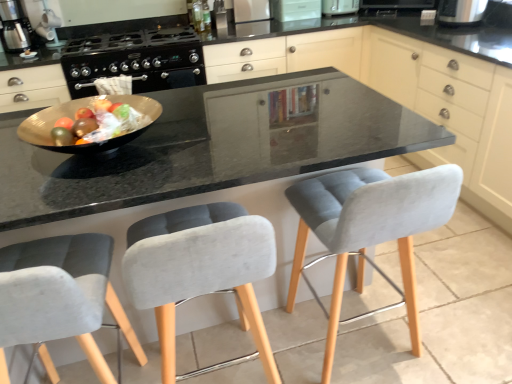
Question: Is metallic silver coffee maker at upper left at the right side of black plastic toaster at upper right, the first appliance when ordered from right to left?

Choices:
 (A) yes
 (B) no

Answer: (B)

Question: From a real-world perspective, is metallic silver coffee maker at upper left below black plastic toaster at upper right, the first appliance when ordered from right to left?

Choices:
 (A) no
 (B) yes

Answer: (A)

Question: Does metallic silver coffee maker at upper left touch black plastic toaster at upper right, the first appliance when ordered from right to left?

Choices:
 (A) no
 (B) yes

Answer: (A)

Question: From the image's perspective, is metallic silver coffee maker at upper left on black plastic toaster at upper right, the fifth appliance positioned from the left?

Choices:
 (A) yes
 (B) no

Answer: (B)

Question: Considering the relative sizes of metallic silver coffee maker at upper left and black plastic toaster at upper right, the fifth appliance positioned from the left, in the image provided, is metallic silver coffee maker at upper left wider than black plastic toaster at upper right, the fifth appliance positioned from the left,?

Choices:
 (A) no
 (B) yes

Answer: (A)

Question: Is there a large distance between metallic silver coffee maker at upper left and black plastic toaster at upper right, the fifth appliance positioned from the left?

Choices:
 (A) yes
 (B) no

Answer: (A)

Question: Is velvet grey chair at center, which is the 3th chair in left-to-right order, positioned in front of white glossy microwave at upper center, which appears as the 3th appliance when viewed from the right?

Choices:
 (A) no
 (B) yes

Answer: (B)

Question: Would you say white glossy microwave at upper center, placed as the 3th appliance when sorted from left to right, is part of velvet grey chair at center, placed as the 1th chair when sorted from right to left,'s contents?

Choices:
 (A) no
 (B) yes

Answer: (A)

Question: From the image's perspective, is velvet grey chair at center, which is the 3th chair in left-to-right order, on white glossy microwave at upper center, placed as the 3th appliance when sorted from left to right?

Choices:
 (A) yes
 (B) no

Answer: (B)

Question: Is velvet grey chair at center, which is the 3th chair in left-to-right order, turned away from white glossy microwave at upper center, which appears as the 3th appliance when viewed from the right?

Choices:
 (A) yes
 (B) no

Answer: (B)

Question: From a real-world perspective, does velvet grey chair at center, placed as the 1th chair when sorted from right to left, sit lower than white glossy microwave at upper center, placed as the 3th appliance when sorted from left to right?

Choices:
 (A) no
 (B) yes

Answer: (B)

Question: Considering the relative sizes of velvet grey chair at center, placed as the 1th chair when sorted from right to left, and white glossy microwave at upper center, which appears as the 3th appliance when viewed from the right, in the image provided, is velvet grey chair at center, placed as the 1th chair when sorted from right to left, taller than white glossy microwave at upper center, which appears as the 3th appliance when viewed from the right,?

Choices:
 (A) yes
 (B) no

Answer: (A)

Question: Are white plastic toaster at upper center, which ranks as the 4th appliance in left-to-right order, and matte gray cabinet at center, which ranks as the 1th cabinetry in left-to-right order, beside each other?

Choices:
 (A) no
 (B) yes

Answer: (A)